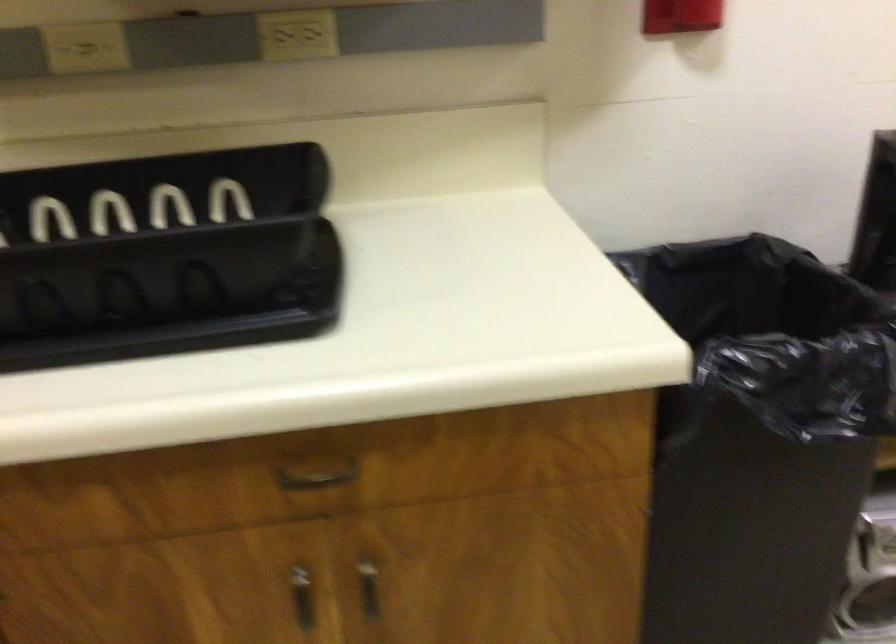
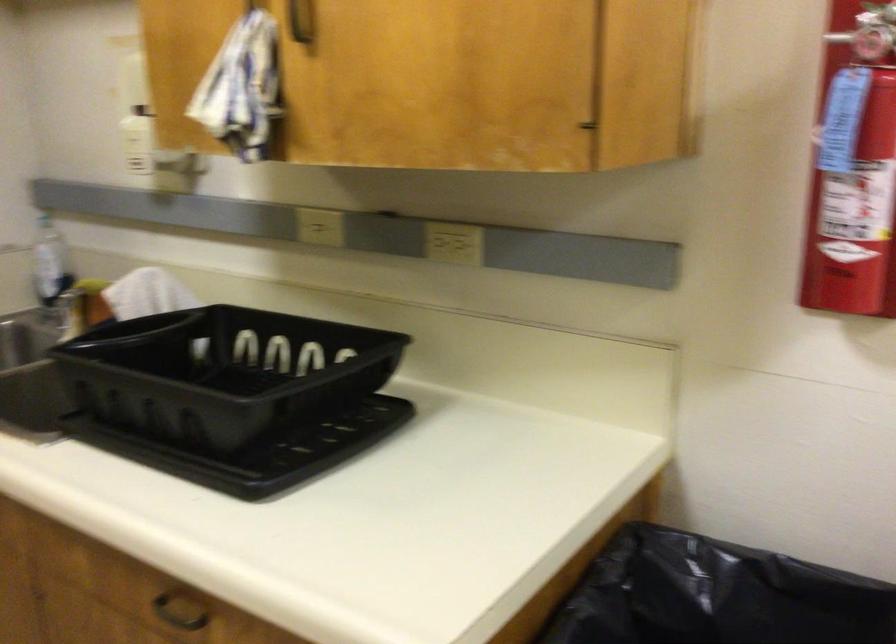
Question: The images are taken continuously from a first-person perspective. In which direction is your viewpoint rotating?

Choices:
 (A) Left
 (B) Right
 (C) Up
 (D) Down

Answer: (A)